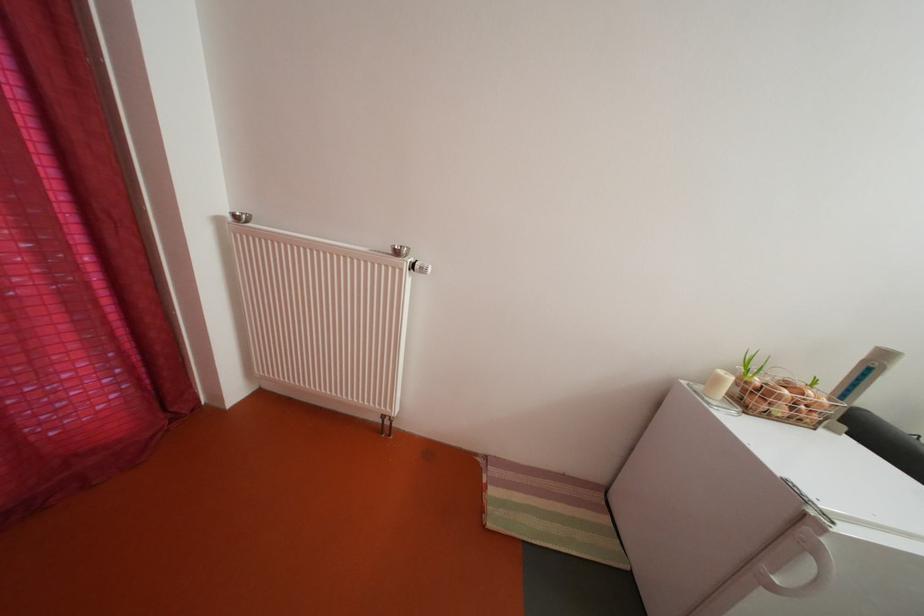
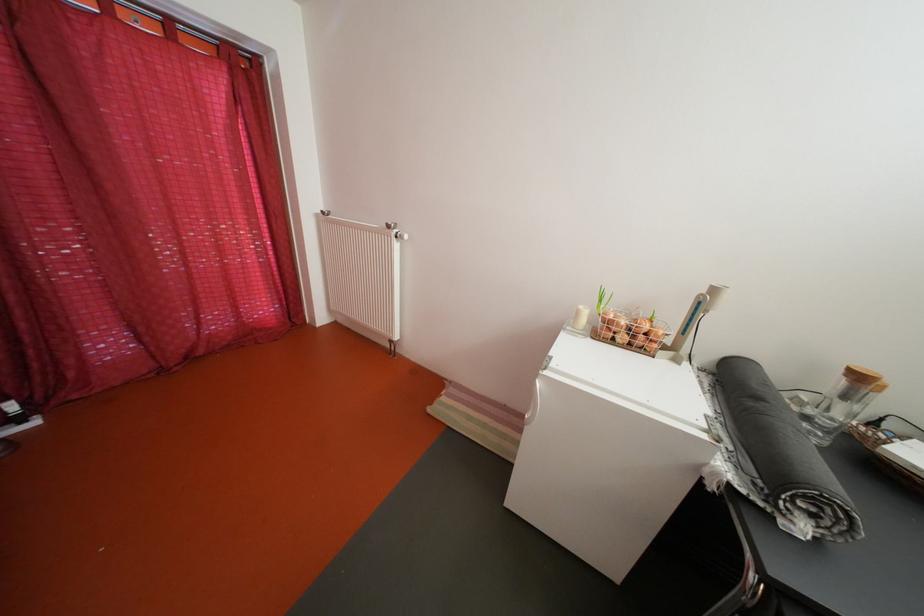
Which direction would the cameraman need to move to produce the second image?

The cameraman walked toward right, backward.